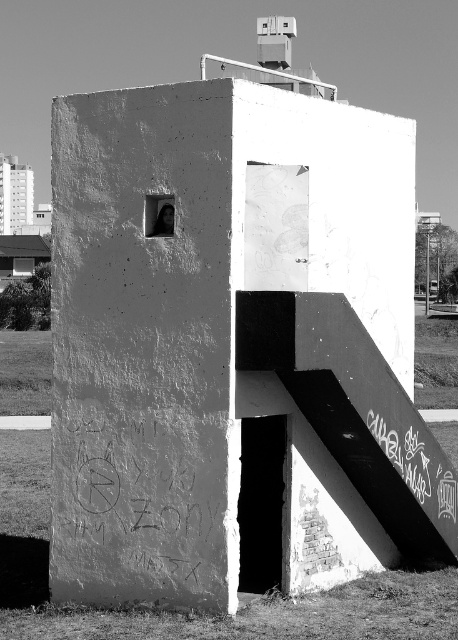
You are a painter with a 1.2 meter wide painting canvas. You want to place your canvas on the ground next to the smooth concrete stair at lower right and the graffiti chalk at lower right. Which object should you place the canvas next to so that it fits without overlapping?

The smooth concrete stair at lower right has a width less than graffiti chalk at lower right. Since the canvas is 1.2 meters wide, you should place it next to the graffiti chalk at lower right as it has more space available.